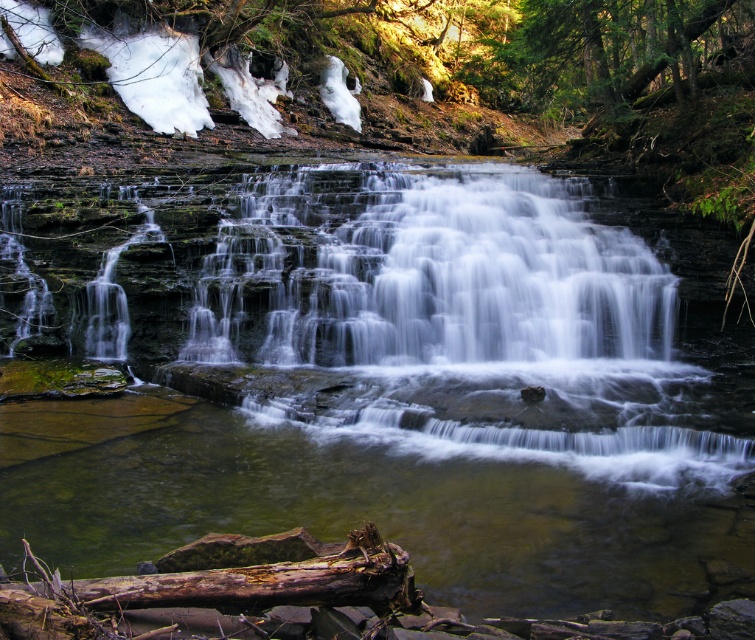
Who is positioned more to the right, clear water at center or rusty wood log at lower center?

Positioned to the right is clear water at center.

Between point (606, 600) and point (334, 636), which one is positioned in front?

Point (334, 636)

At what (x,y) coordinates should I click in order to perform the action: click on clear water at center. Please return your answer as a coordinate pair (x, y). Looking at the image, I should click on (396, 385).